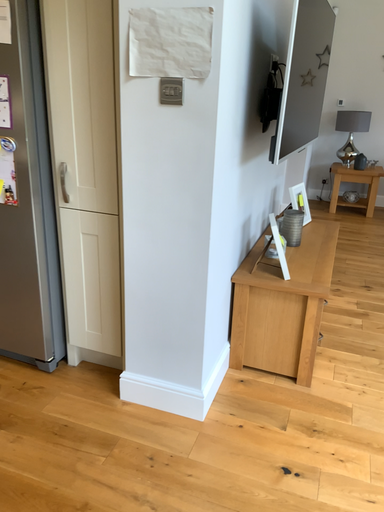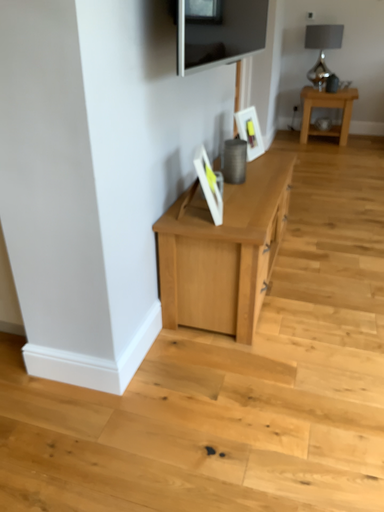
Question: Which way did the camera rotate in the video?

Choices:
 (A) rotated downward
 (B) rotated upward

Answer: (A)